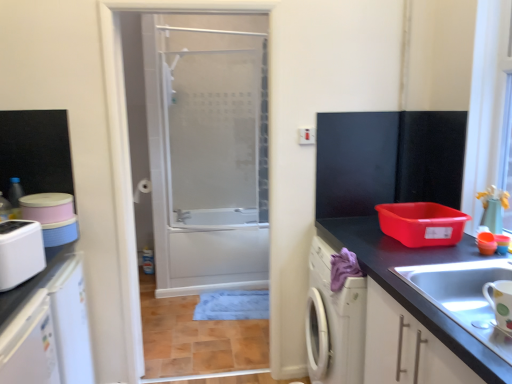
Question: Is white matte cabinet at lower right with matte black countertop at right?

Choices:
 (A) no
 (B) yes

Answer: (A)

Question: Is white matte cabinet at lower right closer to the viewer compared to matte black countertop at right?

Choices:
 (A) yes
 (B) no

Answer: (A)

Question: Is white matte cabinet at lower right smaller than matte black countertop at right?

Choices:
 (A) yes
 (B) no

Answer: (A)

Question: Is white matte cabinet at lower right shorter than matte black countertop at right?

Choices:
 (A) no
 (B) yes

Answer: (B)

Question: Is white matte cabinet at lower right to the right of matte black countertop at right from the viewer's perspective?

Choices:
 (A) no
 (B) yes

Answer: (B)

Question: Can you confirm if white matte cabinet at lower right is wider than matte black countertop at right?

Choices:
 (A) yes
 (B) no

Answer: (B)

Question: Can you confirm if white glossy mug at lower right, which ranks as the 1th appliance in front-to-back order, is wider than transparent glass door at center?

Choices:
 (A) no
 (B) yes

Answer: (A)

Question: Is transparent glass door at center inside white glossy mug at lower right, which ranks as the 1th appliance in front-to-back order?

Choices:
 (A) no
 (B) yes

Answer: (A)

Question: From the image's perspective, is white glossy mug at lower right, marked as the 2th appliance in a back-to-front arrangement, on top of transparent glass door at center?

Choices:
 (A) yes
 (B) no

Answer: (B)

Question: Is white glossy mug at lower right, marked as the 2th appliance in a back-to-front arrangement, directly adjacent to transparent glass door at center?

Choices:
 (A) no
 (B) yes

Answer: (A)

Question: Is white glossy mug at lower right, the 2th appliance positioned from the left, oriented away from transparent glass door at center?

Choices:
 (A) yes
 (B) no

Answer: (B)

Question: Would you say white glossy mug at lower right, marked as the 1th appliance in a right-to-left arrangement, is outside transparent glass door at center?

Choices:
 (A) yes
 (B) no

Answer: (A)

Question: Is transparent glass door at center further to camera compared to white matte cabinet at lower right?

Choices:
 (A) yes
 (B) no

Answer: (A)